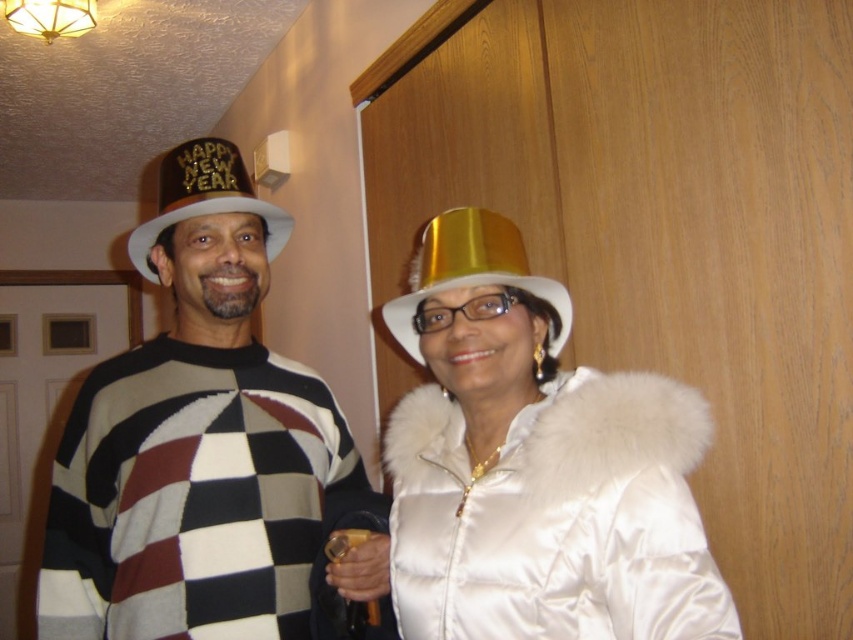
You are standing in the room and want to reach the point at coordinates point (x=535, y=465). Which object is that point located on?

The point (x=535, y=465) is located on the satin gold top hat at center.

You are a fashion designer who wants to place a gold shiny hat at center on top of the white satin coat at center. Based on the scene description, will the hat fit on top of the coat without falling off?

The white satin coat at center is much taller than the gold shiny hat at center, so placing the hat on top would be stable and it won not fall off.